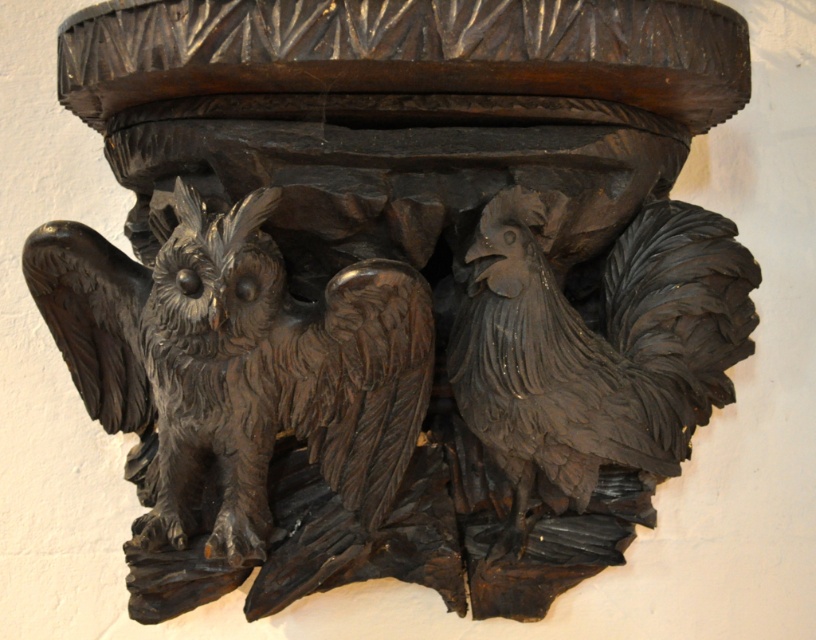
Question: Which point is farther to the camera?

Choices:
 (A) dark brown wood owl at left
 (B) dark wood rooster at right

Answer: (B)

Question: Among these points, which one is farthest from the camera?

Choices:
 (A) (382, 301)
 (B) (710, 291)

Answer: (B)

Question: Is dark brown wood owl at left above dark wood rooster at right?

Choices:
 (A) yes
 (B) no

Answer: (A)

Question: Does dark brown wood owl at left come in front of dark wood rooster at right?

Choices:
 (A) no
 (B) yes

Answer: (B)

Question: Is dark brown wood owl at left positioned before dark wood rooster at right?

Choices:
 (A) no
 (B) yes

Answer: (B)